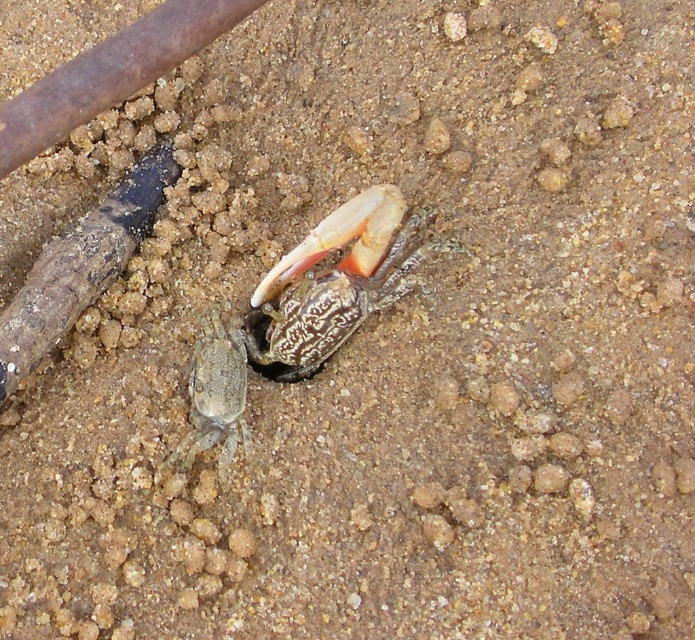
You are an engineer designing a robotic arm to retrieve the shiny metallic crab at center from its sandy environment. Based on the coordinates provided, where exactly should the robotic arm aim to pick up the crab?

The robotic arm should aim for the coordinates point (x=336, y=282) to pick up the shiny metallic crab at center.

You are a marine biologist observing the sandy beach scene. You notice the shiny metallic crab at center and the gray matte crab at lower left. Which crab is positioned higher in the image?

The shiny metallic crab at center is positioned higher in the image than the gray matte crab at lower left.